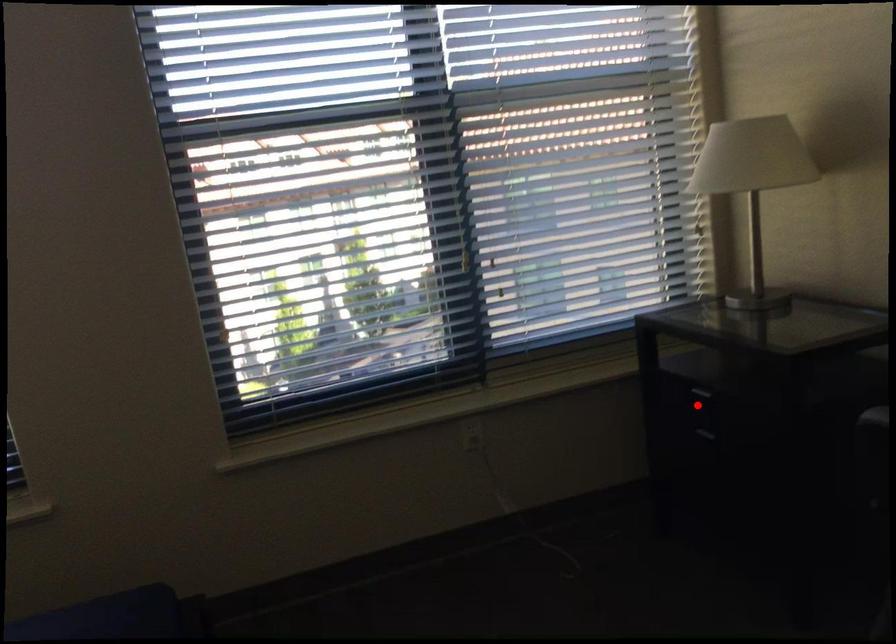
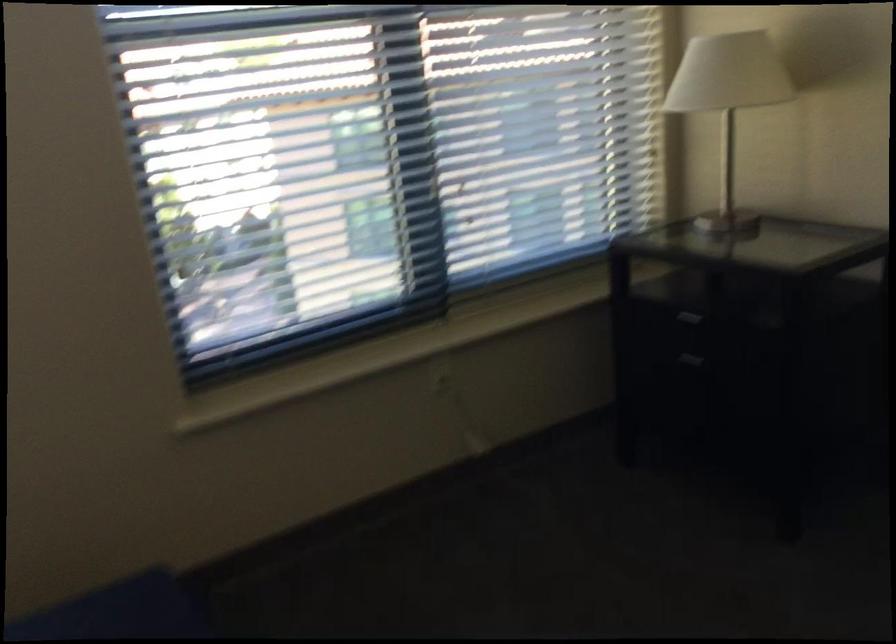
In the second image, find the point that corresponds to the highlighted location in the first image.

(682, 330)